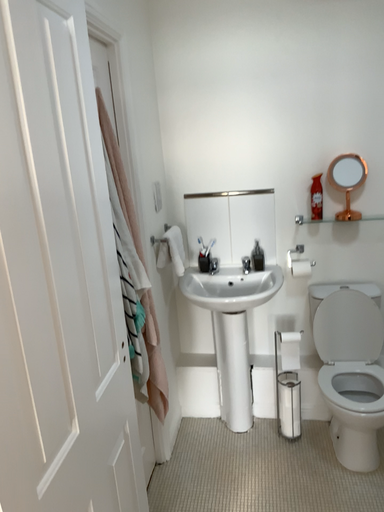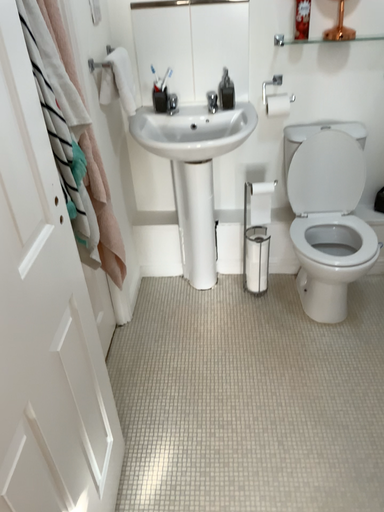
Question: Which way did the camera rotate in the video?

Choices:
 (A) rotated upward
 (B) rotated downward

Answer: (B)